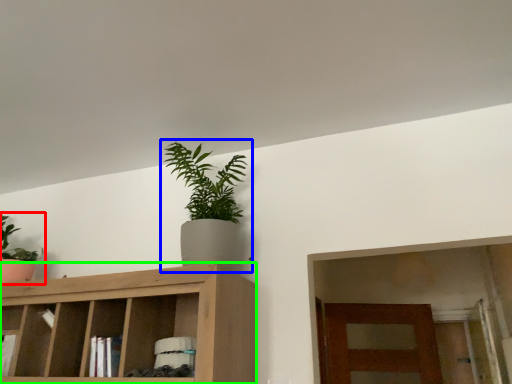
Question: Which object is the closest to the houseplant (highlighted by a red box)? Choose among these: houseplant (highlighted by a blue box) or cabinetry (highlighted by a green box).

Choices:
 (A) houseplant
 (B) cabinetry

Answer: (B)